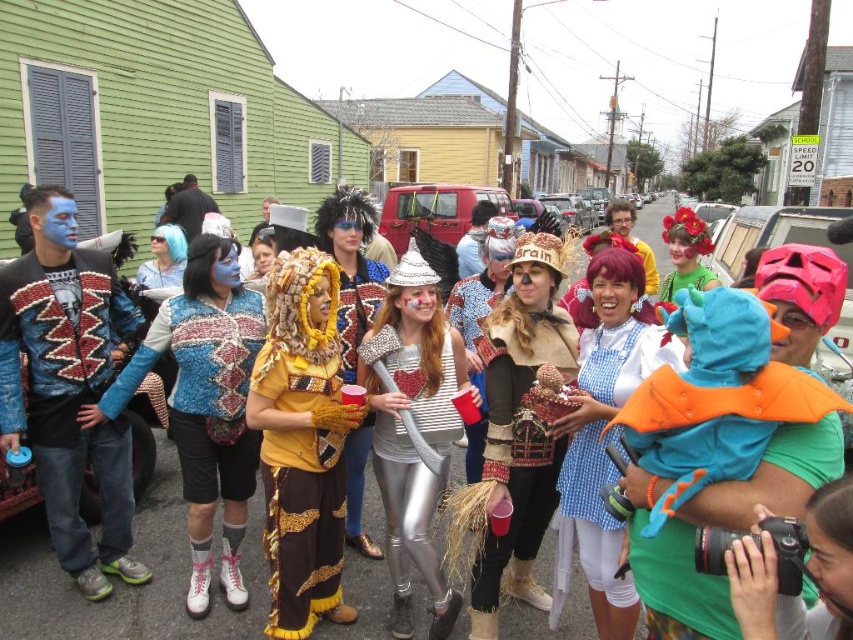
Can you confirm if shiny metallic costume at center is shorter than silver metallic axe at center?

In fact, shiny metallic costume at center may be taller than silver metallic axe at center.

Locate an element on the screen. The width and height of the screenshot is (853, 640). shiny metallic costume at center is located at coordinates (120, 582).

From the picture: Is matte blue face paint at left further to the viewer compared to gold sequined pants at center?

That is True.

What do you see at coordinates (68, 387) in the screenshot? The height and width of the screenshot is (640, 853). I see `matte blue face paint at left` at bounding box center [68, 387].

At what (x,y) coordinates should I click in order to perform the action: click on matte blue face paint at left. Please return your answer as a coordinate pair (x, y). Image resolution: width=853 pixels, height=640 pixels. Looking at the image, I should click on (68, 387).

Find the location of a particular element. matte blue face paint at left is located at coordinates (68, 387).

Image resolution: width=853 pixels, height=640 pixels. In order to click on beaded fabric scarecrow at center in this screenshot , I will do point(519,435).

Does beaded fabric scarecrow at center have a lesser width compared to silver metallic axe at center?

No.

The height and width of the screenshot is (640, 853). In order to click on beaded fabric scarecrow at center in this screenshot , I will do pyautogui.click(x=519, y=435).